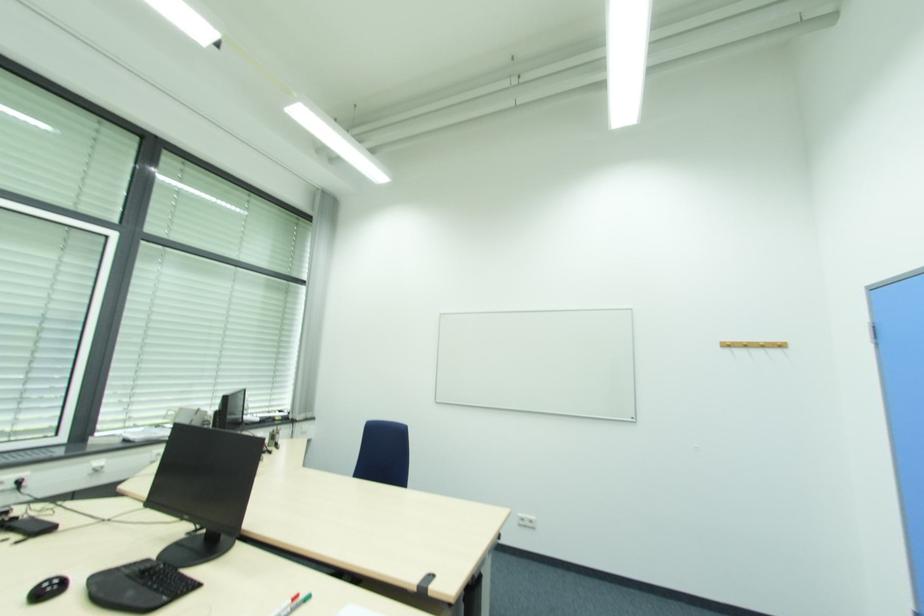
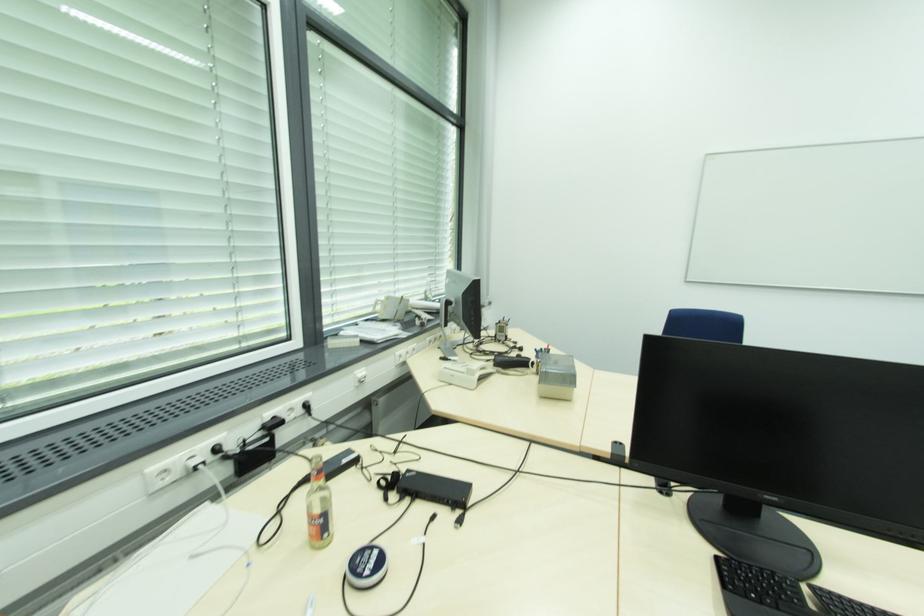
The images are taken continuously from a first-person perspective. In which direction are you moving?

The cameraman moved toward left, forward.